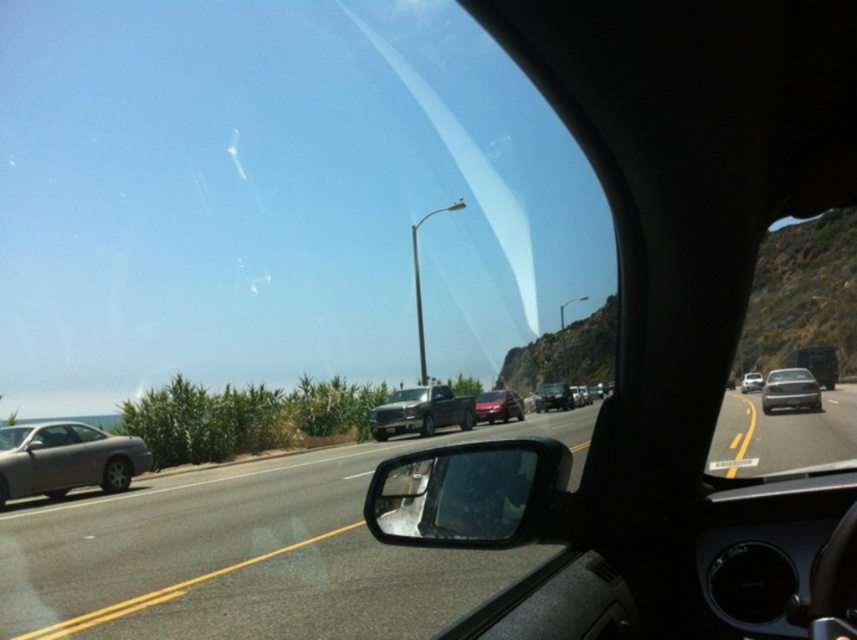
You are a driver trying to estimate the road width while avoiding obstacles. Given that the black glossy rearview mirror at lower right is 10 cm wide, can you determine if the gray asphalt road at center is wider than 10 cm?

The gray asphalt road at center is wider than the black glossy rearview mirror at lower right, which is 10 cm wide. Therefore, the gray asphalt road at center is wider than 10 cm.

Looking at this image, you are a driver trying to distinguish between two sedans ahead on the road. You see a black glossy sedan at center and a black matte sedan at center. Which one appears bigger in size?

The black glossy sedan at center appears bigger in size than the black matte sedan at center.

You are driving a car and need to check your blind spot before changing lanes. You look at the black glossy rearview mirror at lower right and the gray asphalt road at center. Which object is closer to you?

The black glossy rearview mirror at lower right is closer to you because it is positioned nearer than the gray asphalt road at center.